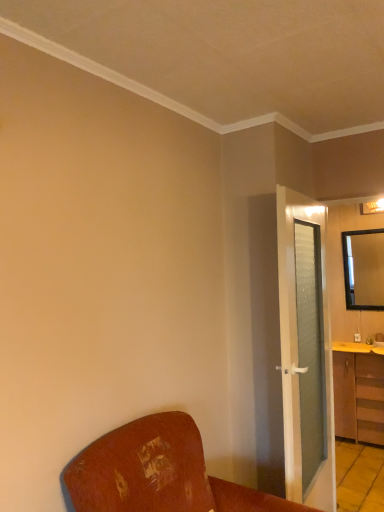
Question: From a real-world perspective, is wooden chair at lower left positioned under green frosted glass door at right based on gravity?

Choices:
 (A) no
 (B) yes

Answer: (B)

Question: Is wooden chair at lower left thinner than green frosted glass door at right?

Choices:
 (A) no
 (B) yes

Answer: (A)

Question: Is wooden chair at lower left facing away from green frosted glass door at right?

Choices:
 (A) no
 (B) yes

Answer: (A)

Question: Is wooden chair at lower left smaller than green frosted glass door at right?

Choices:
 (A) yes
 (B) no

Answer: (B)

Question: Does wooden chair at lower left have a lesser height compared to green frosted glass door at right?

Choices:
 (A) yes
 (B) no

Answer: (A)

Question: Considering the relative sizes of wooden chair at lower left and green frosted glass door at right in the image provided, is wooden chair at lower left wider than green frosted glass door at right?

Choices:
 (A) yes
 (B) no

Answer: (A)

Question: Is yellow wood counter top at right inside green frosted glass door at right?

Choices:
 (A) yes
 (B) no

Answer: (B)

Question: From a real-world perspective, does green frosted glass door at right stand above yellow wood counter top at right?

Choices:
 (A) no
 (B) yes

Answer: (B)

Question: Is green frosted glass door at right at the left side of yellow wood counter top at right?

Choices:
 (A) no
 (B) yes

Answer: (B)

Question: Is yellow wood counter top at right at the back of green frosted glass door at right?

Choices:
 (A) no
 (B) yes

Answer: (A)

Question: Are green frosted glass door at right and yellow wood counter top at right beside each other?

Choices:
 (A) no
 (B) yes

Answer: (A)

Question: Is green frosted glass door at right bigger than yellow wood counter top at right?

Choices:
 (A) no
 (B) yes

Answer: (B)

Question: From a real-world perspective, is green frosted glass door at right on wooden chair at lower left?

Choices:
 (A) no
 (B) yes

Answer: (B)